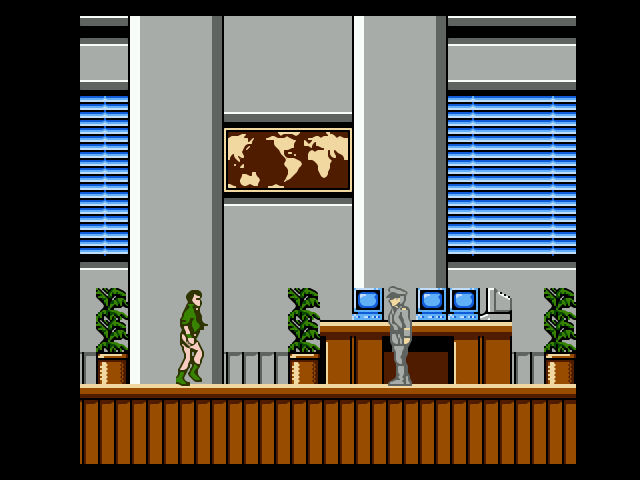
Where is `blue computer`? This screenshot has height=480, width=640. blue computer is located at coordinates coord(362,298), coord(438,310), coord(465,304).